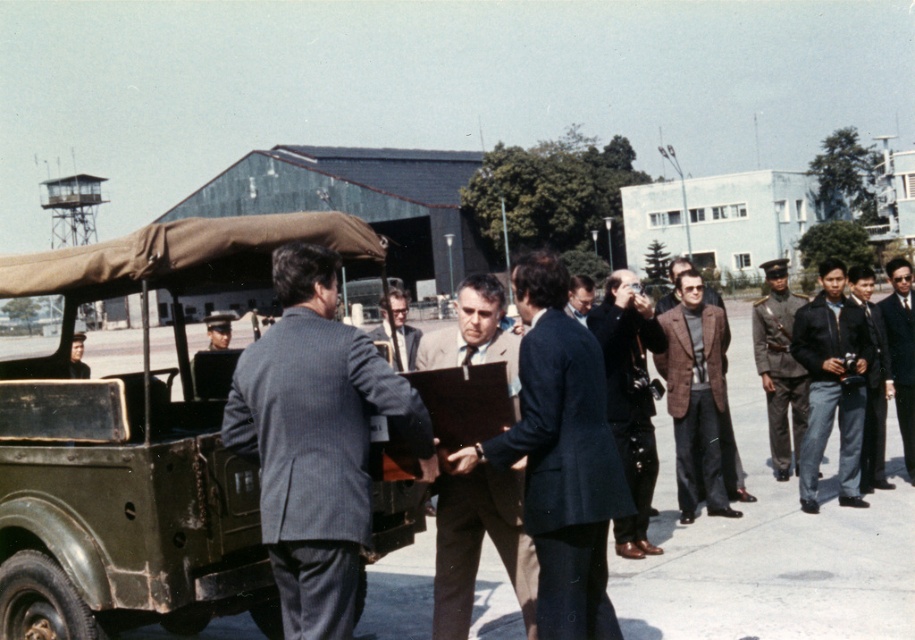
Does dark blue wool suit at center have a greater height compared to dark brown leather jacket at center?

No, dark blue wool suit at center is not taller than dark brown leather jacket at center.

Consider the image. Does dark blue wool suit at center have a larger size compared to dark brown leather jacket at center?

Actually, dark blue wool suit at center might be smaller than dark brown leather jacket at center.

I want to click on dark blue wool suit at center, so click(565, 476).

You are a GUI agent. You are given a task and a screenshot of the screen. Output one action in this format:
    pyautogui.click(x=<x>, y=<y>)
    Task: Click on the dark blue wool suit at center
    The width and height of the screenshot is (915, 640).
    Given the screenshot: What is the action you would take?
    pyautogui.click(x=565, y=476)

The image size is (915, 640). Describe the element at coordinates (316, 440) in the screenshot. I see `gray pinstripe suit at center` at that location.

Can you confirm if gray pinstripe suit at center is bigger than dark brown uniform at right?

No.

Which is in front, point (304, 252) or point (802, 387)?

Point (304, 252) is more forward.

Find the location of a particular element. gray pinstripe suit at center is located at coordinates (316, 440).

Based on the photo, does light brown suit at center have a greater height compared to dark blue suit at right?

No.

Who is shorter, light brown suit at center or dark blue suit at right?

With less height is light brown suit at center.

This screenshot has width=915, height=640. In order to click on light brown suit at center in this screenshot , I will do `click(480, 545)`.